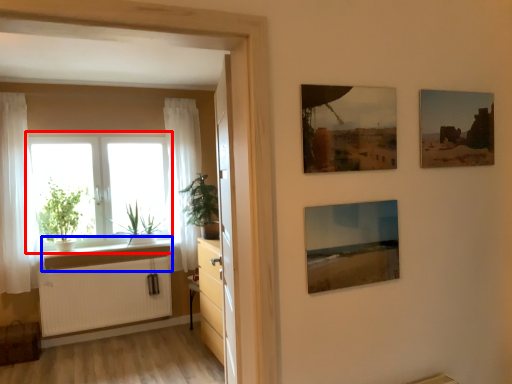
Question: Among these objects, which one is farthest to the camera, window (highlighted by a red box) or window sill (highlighted by a blue box)?

Choices:
 (A) window
 (B) window sill

Answer: (A)